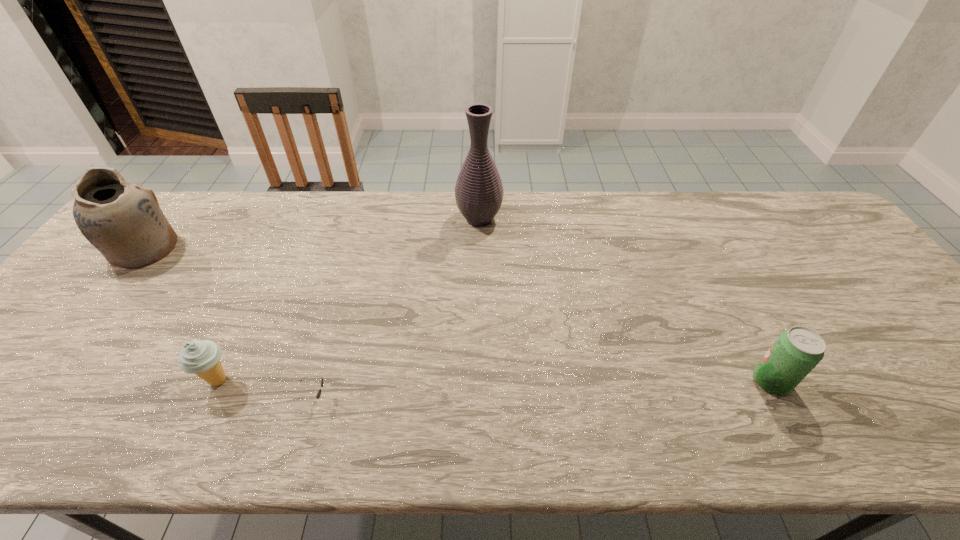
Find the location of a particular element. This screenshot has height=540, width=960. free space located 0.060m on the right of the soda is located at coordinates (816, 381).

This screenshot has width=960, height=540. What are the coordinates of `blank space located on the back of the icecream` in the screenshot? It's located at (267, 275).

Identify the location of free location located in front of the lenses of the shortest object. The width and height of the screenshot is (960, 540). (416, 399).

You are a GUI agent. You are given a task and a screenshot of the screen. Output one action in this format:
    pyautogui.click(x=<x>, y=<y>)
    Task: Click on the vase that is at the far edge
    This screenshot has width=960, height=540.
    Given the screenshot: What is the action you would take?
    pyautogui.click(x=479, y=192)

At what (x,y) coordinates should I click in order to perform the action: click on pottery that is at the far edge. Please return your answer as a coordinate pair (x, y). Image resolution: width=960 pixels, height=540 pixels. Looking at the image, I should click on (122, 220).

The height and width of the screenshot is (540, 960). I want to click on object that is positioned at the near edge, so click(x=318, y=395).

Identify the location of object that is positioned at the left edge. Image resolution: width=960 pixels, height=540 pixels. (122, 220).

Where is `object situated at the far left corner`? This screenshot has height=540, width=960. object situated at the far left corner is located at coordinates (122, 220).

Locate an element on the screen. This screenshot has width=960, height=540. vacant space at the far edge is located at coordinates (567, 222).

I want to click on free region at the near edge of the desktop, so click(451, 451).